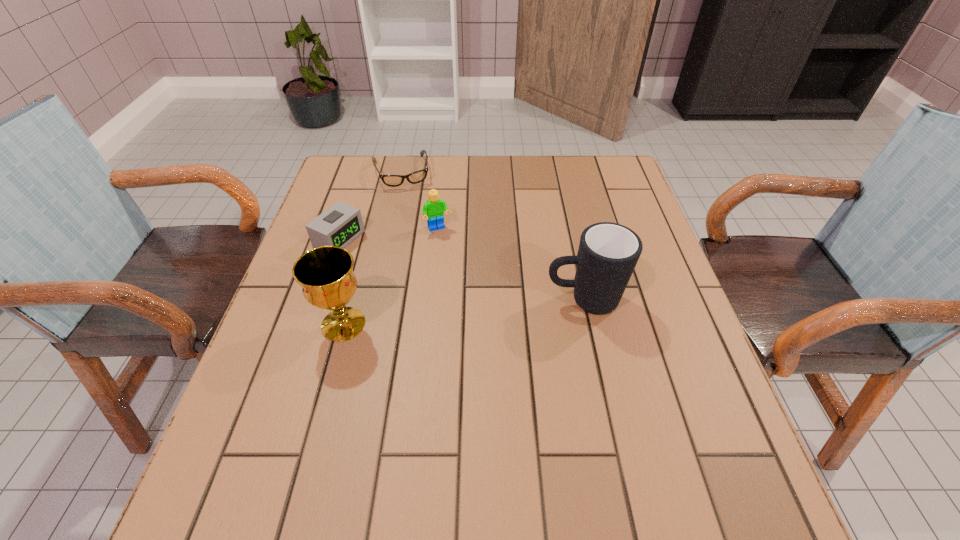
At what (x,y) coordinates should I click in order to perform the action: click on chalice. Please return your answer as a coordinate pair (x, y). This screenshot has width=960, height=540. Looking at the image, I should click on (325, 273).

Identify the location of mug. The image size is (960, 540). (608, 252).

At what (x,y) coordinates should I click in order to perform the action: click on the third shortest object. Please return your answer as a coordinate pair (x, y). The image size is (960, 540). Looking at the image, I should click on (433, 209).

This screenshot has height=540, width=960. Find the location of `the second object from right to left`. the second object from right to left is located at coordinates (433, 209).

You are a GUI agent. You are given a task and a screenshot of the screen. Output one action in this format:
    pyautogui.click(x=<x>, y=<y>)
    Task: Click on the alarm clock
    The width and height of the screenshot is (960, 540).
    Given the screenshot: What is the action you would take?
    pyautogui.click(x=341, y=224)

The image size is (960, 540). In order to click on the farthest object in this screenshot , I will do `click(418, 176)`.

At what (x,y) coordinates should I click in order to perform the action: click on spectacles. Please return your answer as a coordinate pair (x, y). The width and height of the screenshot is (960, 540). Looking at the image, I should click on (418, 176).

The width and height of the screenshot is (960, 540). In order to click on vacant point located on the right of the chalice in this screenshot , I will do `click(407, 324)`.

Find the location of `blank space located on the side of the rightmost object with the handle`. blank space located on the side of the rightmost object with the handle is located at coordinates (380, 300).

Where is `free space located 0.380m on the side of the rightmost object with the handle`? Image resolution: width=960 pixels, height=540 pixels. free space located 0.380m on the side of the rightmost object with the handle is located at coordinates (375, 300).